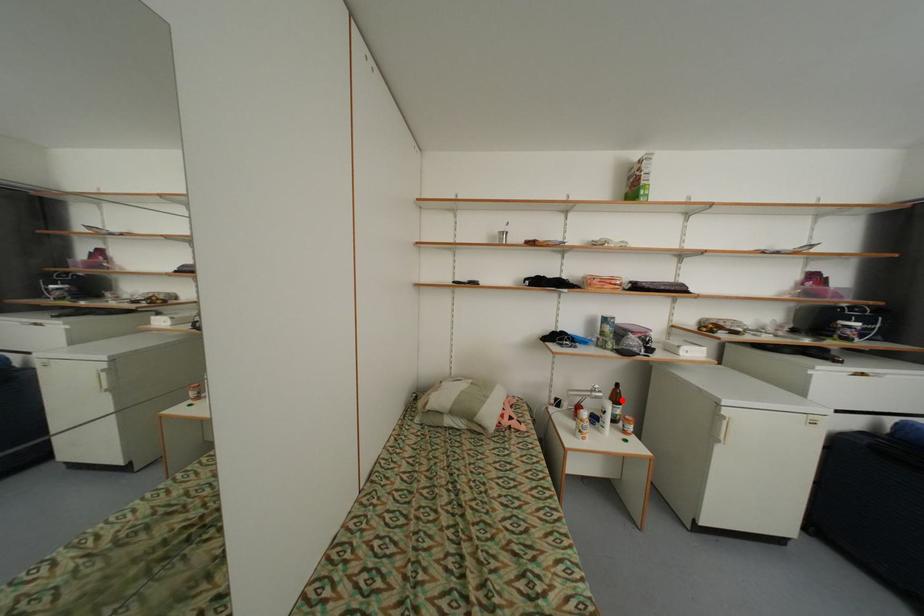
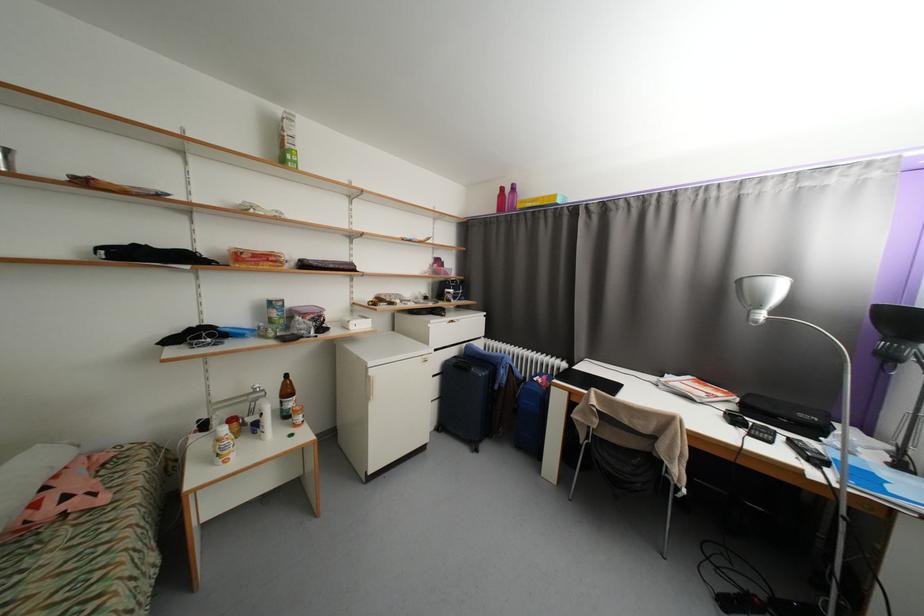
Locate, in the second image, the point that corresponds to the highlighted location in the first image.

(294, 392)